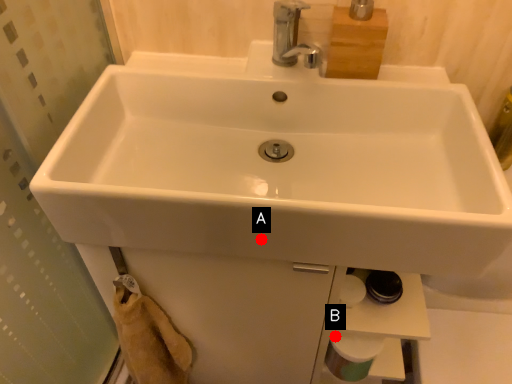
Question: Two points are circled on the image, labeled by A and B beside each circle. Which point is further to the camera?

Choices:
 (A) A is further
 (B) B is further

Answer: (B)